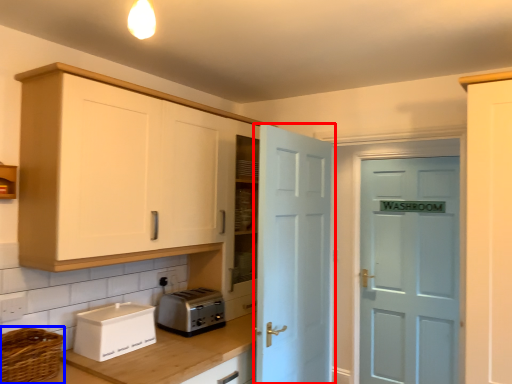
Question: Which object appears farthest to the camera in this image, door (highlighted by a red box) or basket (highlighted by a blue box)?

Choices:
 (A) door
 (B) basket

Answer: (A)